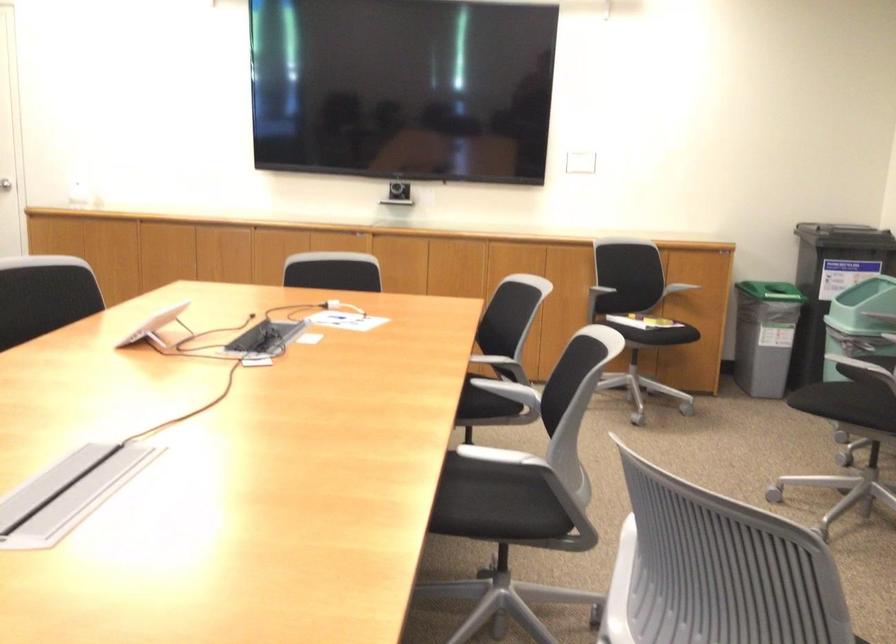
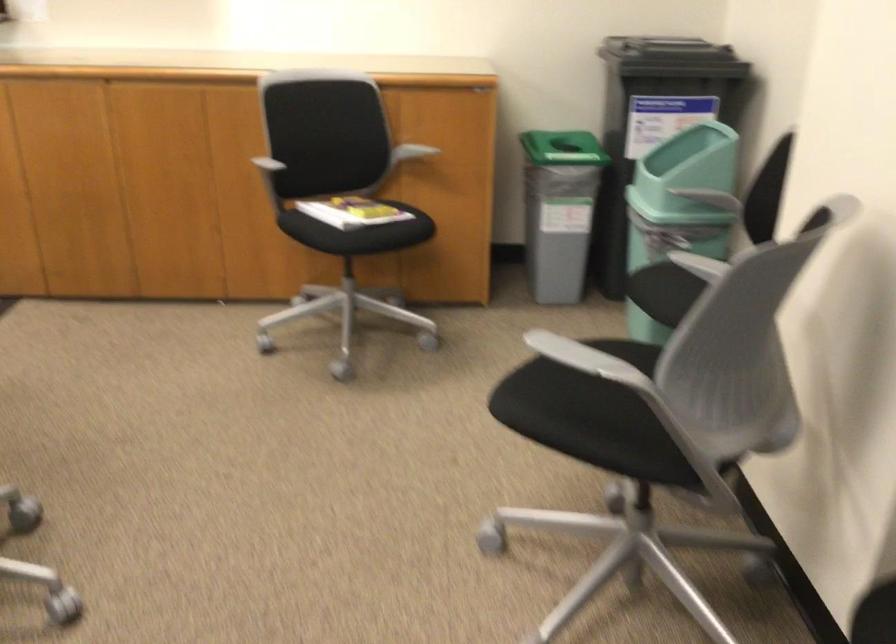
The images are taken continuously from a first-person perspective. In which direction are you moving?

The cameraman walked toward right, forward.